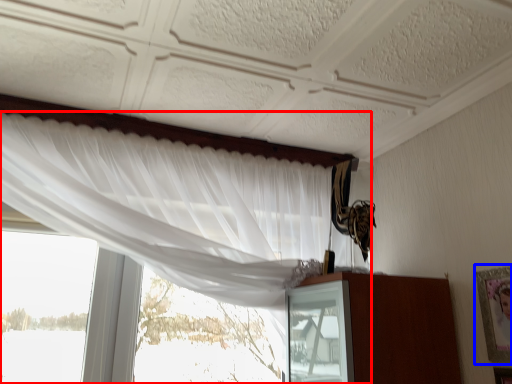
Question: Which point is further to the camera, curtain (highlighted by a red box) or picture frame (highlighted by a blue box)?

Choices:
 (A) curtain
 (B) picture frame

Answer: (B)